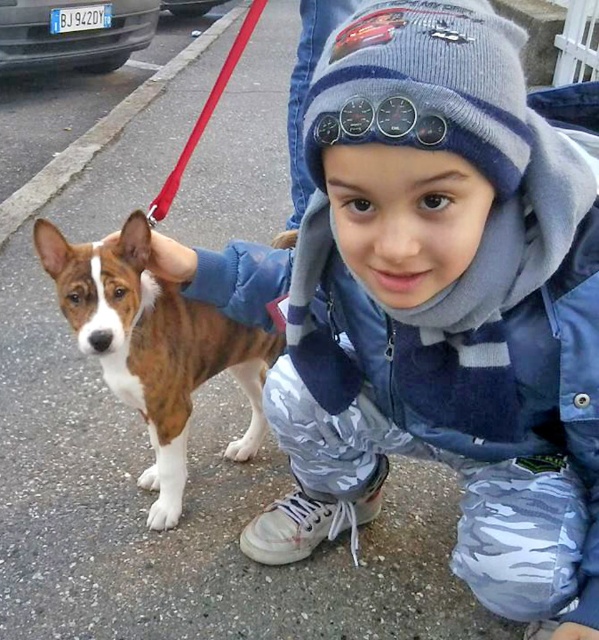
What do you see at coordinates (153, 348) in the screenshot?
I see `brown brindle fur at center` at bounding box center [153, 348].

Who is shorter, brown brindle fur at center or red nylon leash at upper center?

Standing shorter between the two is brown brindle fur at center.

Describe the element at coordinates (153, 348) in the screenshot. This screenshot has height=640, width=599. I see `brown brindle fur at center` at that location.

This screenshot has width=599, height=640. Find the location of `brown brindle fur at center`. brown brindle fur at center is located at coordinates (153, 348).